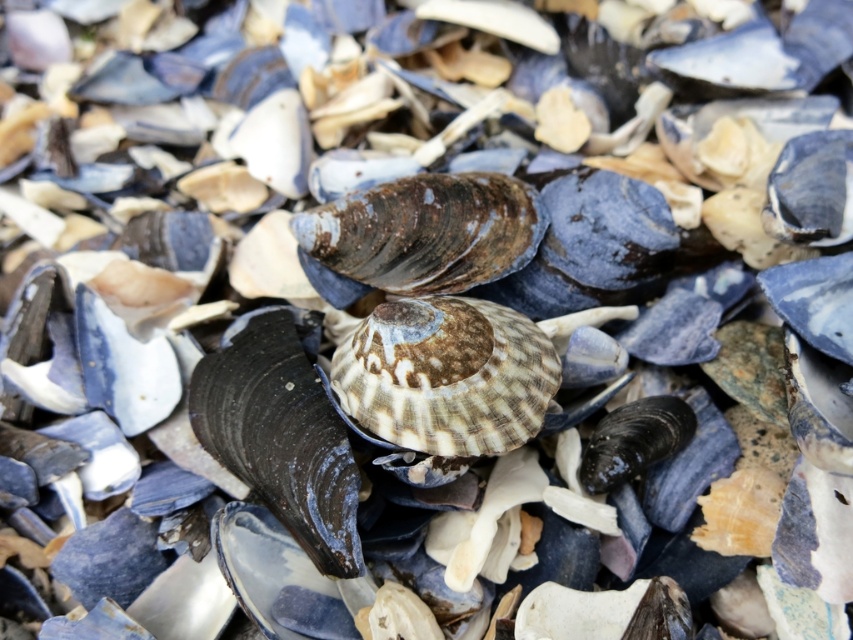
Consider the image. You are a beachcomber looking for the tallest shell in the center area. Which one between the speckled brown shell at center and the rusty metallic shellfish at center should you choose?

The rusty metallic shellfish at center is taller than the speckled brown shell at center, so you should choose the rusty metallic shellfish at center.

You are a photographer trying to capture a closeup of the two points in the image. Which point, point (544, 385) or point (459, 220), is closer to your camera lens?

Point (544, 385) is closer to the camera lens than point (459, 220).